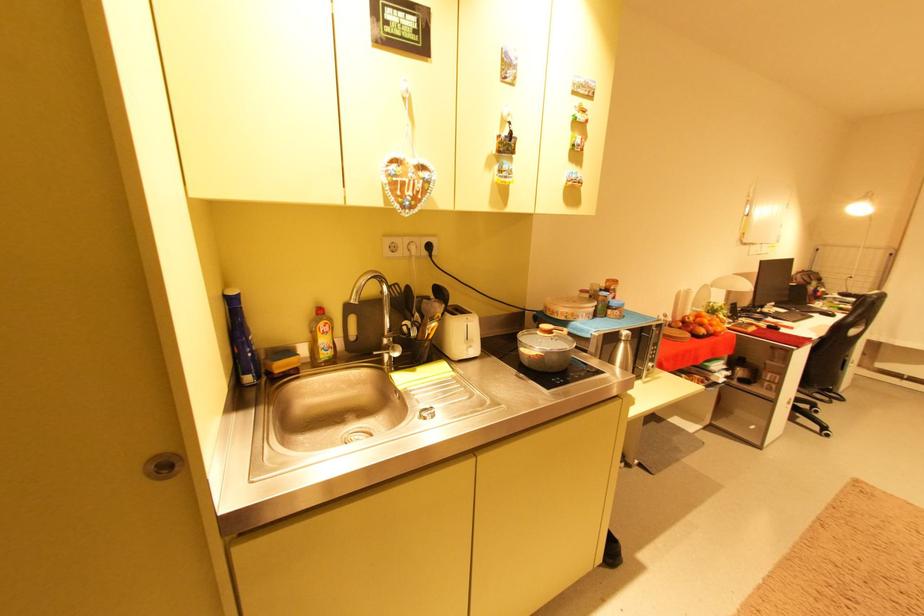
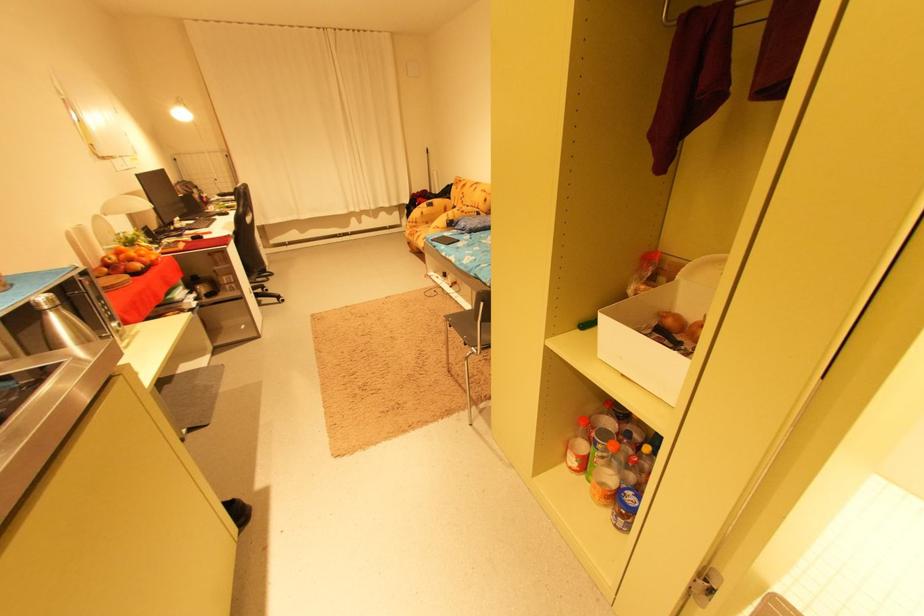
Where in the second image is the point corresponding to (x=714, y=331) from the first image?

(151, 265)